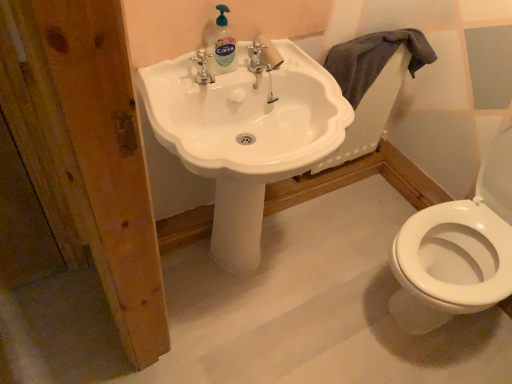
Question: Is gray cotton towel at upper right inside white glossy sink at center?

Choices:
 (A) no
 (B) yes

Answer: (A)

Question: Is white glossy sink at center looking in the opposite direction of gray cotton towel at upper right?

Choices:
 (A) no
 (B) yes

Answer: (A)

Question: Does white glossy sink at center turn towards gray cotton towel at upper right?

Choices:
 (A) yes
 (B) no

Answer: (B)

Question: Can you confirm if white glossy sink at center is shorter than gray cotton towel at upper right?

Choices:
 (A) yes
 (B) no

Answer: (B)

Question: From a real-world perspective, is white glossy sink at center on gray cotton towel at upper right?

Choices:
 (A) no
 (B) yes

Answer: (A)

Question: Is there a large distance between white glossy sink at center and gray cotton towel at upper right?

Choices:
 (A) yes
 (B) no

Answer: (B)

Question: Can you confirm if gray cotton towel at upper right is positioned to the left of clear plastic bottle at upper center?

Choices:
 (A) no
 (B) yes

Answer: (A)

Question: From the image's perspective, is gray cotton towel at upper right on top of clear plastic bottle at upper center?

Choices:
 (A) no
 (B) yes

Answer: (A)

Question: Does gray cotton towel at upper right have a lesser width compared to clear plastic bottle at upper center?

Choices:
 (A) yes
 (B) no

Answer: (B)

Question: Can you confirm if gray cotton towel at upper right is bigger than clear plastic bottle at upper center?

Choices:
 (A) yes
 (B) no

Answer: (A)

Question: Can you confirm if gray cotton towel at upper right is taller than clear plastic bottle at upper center?

Choices:
 (A) no
 (B) yes

Answer: (B)

Question: Are gray cotton towel at upper right and clear plastic bottle at upper center making contact?

Choices:
 (A) no
 (B) yes

Answer: (A)

Question: Does gray cotton towel at upper right have a larger size compared to white glossy sink at center?

Choices:
 (A) yes
 (B) no

Answer: (B)